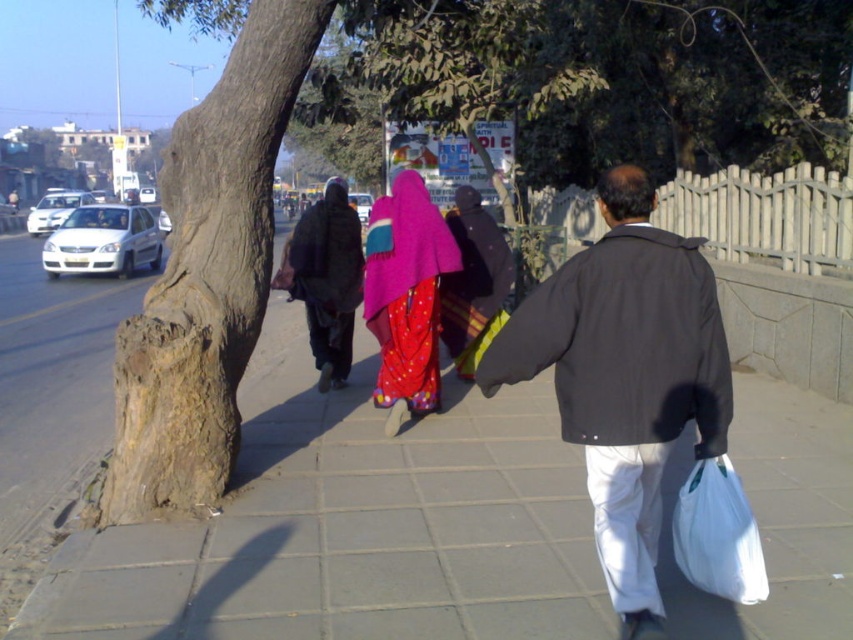
Which is above, brown rough bark tree at left or dark brown fabric at center?

brown rough bark tree at left

Which is behind, point (131, 476) or point (306, 282)?

The point (306, 282) is more distant.

What are the coordinates of `brown rough bark tree at left` in the screenshot? It's located at (207, 275).

Based on the photo, is dark gray jacket at center closer to camera compared to dark brown fabric at center?

Yes, it is in front of dark brown fabric at center.

Between dark gray jacket at center and dark brown fabric at center, which one is positioned lower?

dark gray jacket at center is lower down.

Is point (474, 376) positioned in front of point (355, 296)?

Yes, it is in front of point (355, 296).

Where is `dark gray jacket at center`? The image size is (853, 640). dark gray jacket at center is located at coordinates (625, 376).

Based on the photo, is dark gray jacket at center thinner than shiny pink fabric at center?

In fact, dark gray jacket at center might be wider than shiny pink fabric at center.

Is point (606, 256) positioned behind point (405, 209)?

No.

You are a GUI agent. You are given a task and a screenshot of the screen. Output one action in this format:
    pyautogui.click(x=<x>, y=<y>)
    Task: Click on the dark gray jacket at center
    This screenshot has width=853, height=640.
    Given the screenshot: What is the action you would take?
    pyautogui.click(x=625, y=376)